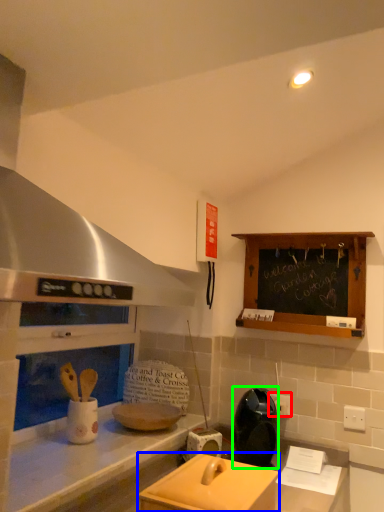
Question: Which object is the farthest from electric outlet (highlighted by a red box)? Choose among these: appliance (highlighted by a blue box) or appliance (highlighted by a green box).

Choices:
 (A) appliance
 (B) appliance

Answer: (A)